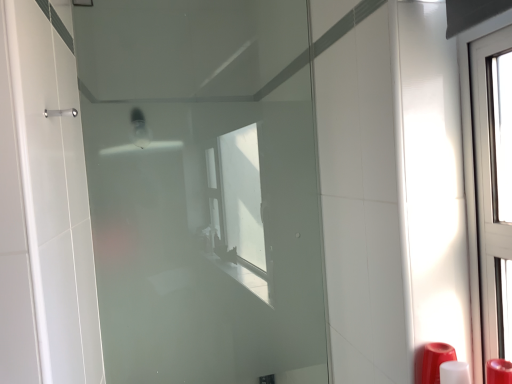
Question: Is red plastic soap dispenser at lower right to the left of frosted glass door at center from the viewer's perspective?

Choices:
 (A) yes
 (B) no

Answer: (B)

Question: Is red plastic soap dispenser at lower right to the right of frosted glass door at center from the viewer's perspective?

Choices:
 (A) no
 (B) yes

Answer: (B)

Question: Is red plastic soap dispenser at lower right located outside frosted glass door at center?

Choices:
 (A) yes
 (B) no

Answer: (A)

Question: Is red plastic soap dispenser at lower right smaller than frosted glass door at center?

Choices:
 (A) yes
 (B) no

Answer: (A)

Question: Considering the relative sizes of red plastic soap dispenser at lower right and frosted glass door at center in the image provided, is red plastic soap dispenser at lower right taller than frosted glass door at center?

Choices:
 (A) yes
 (B) no

Answer: (B)

Question: Is red plastic soap dispenser at lower right facing away from frosted glass door at center?

Choices:
 (A) no
 (B) yes

Answer: (A)

Question: Is frosted glass door at center directly adjacent to red plastic soap dispenser at lower right?

Choices:
 (A) yes
 (B) no

Answer: (B)

Question: Does frosted glass door at center have a larger size compared to red plastic soap dispenser at lower right?

Choices:
 (A) yes
 (B) no

Answer: (A)

Question: From a real-world perspective, does frosted glass door at center stand above red plastic soap dispenser at lower right?

Choices:
 (A) no
 (B) yes

Answer: (B)

Question: Can you confirm if frosted glass door at center is taller than red plastic soap dispenser at lower right?

Choices:
 (A) yes
 (B) no

Answer: (A)

Question: Is frosted glass door at center oriented away from red plastic soap dispenser at lower right?

Choices:
 (A) yes
 (B) no

Answer: (B)

Question: Does frosted glass door at center have a greater width compared to red plastic soap dispenser at lower right?

Choices:
 (A) yes
 (B) no

Answer: (B)

Question: Considering the positions of frosted glass door at center and red plastic soap dispenser at lower right in the image, is frosted glass door at center wider or thinner than red plastic soap dispenser at lower right?

Choices:
 (A) thin
 (B) wide

Answer: (A)